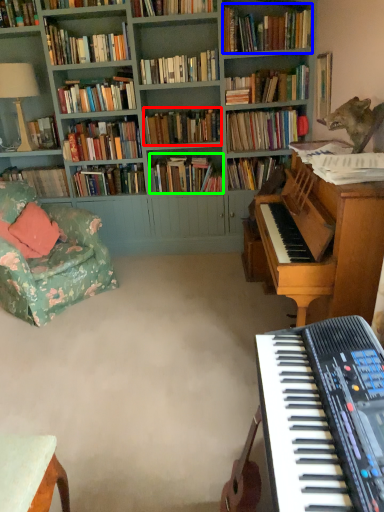
Question: Estimate the real-world distances between objects in this image. Which object is closer to book (highlighted by a red box), book (highlighted by a blue box) or book (highlighted by a green box)?

Choices:
 (A) book
 (B) book

Answer: (B)